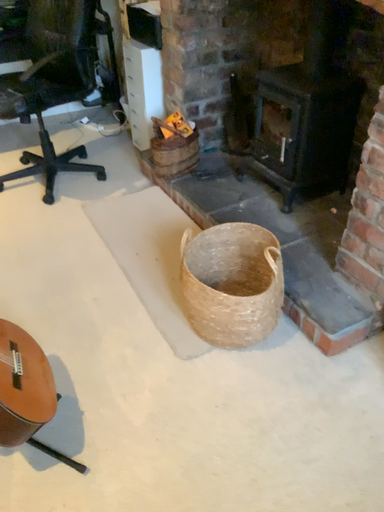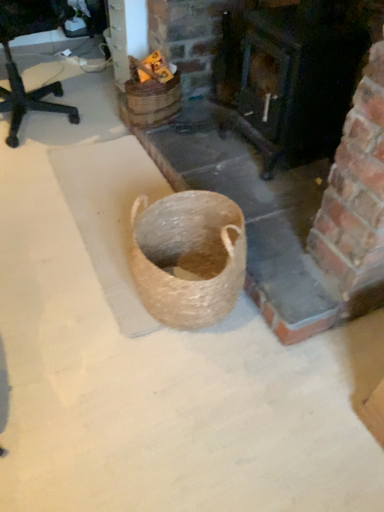
Question: Which way did the camera rotate in the video?

Choices:
 (A) rotated downward
 (B) rotated upward

Answer: (A)